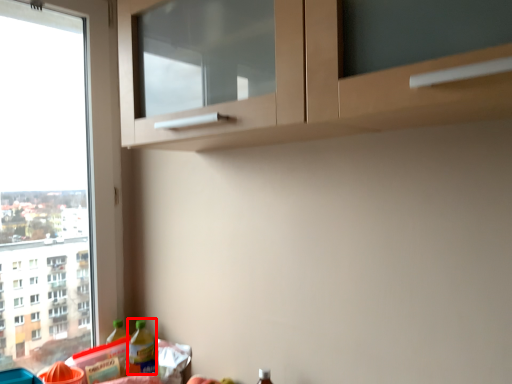
Question: From the image, what is the correct spatial relationship of bottle (annotated by the red box) in relation to bottle?

Choices:
 (A) right
 (B) left

Answer: (A)